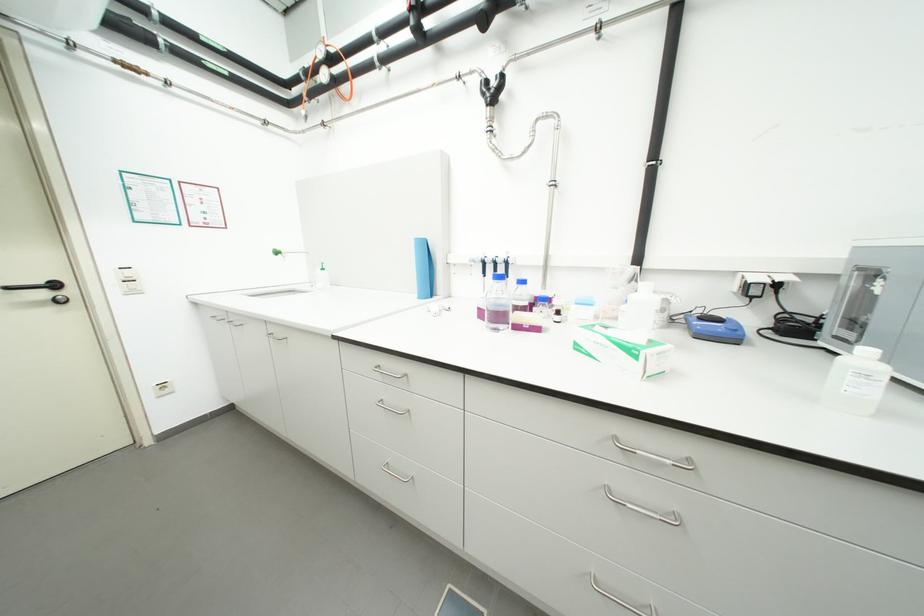
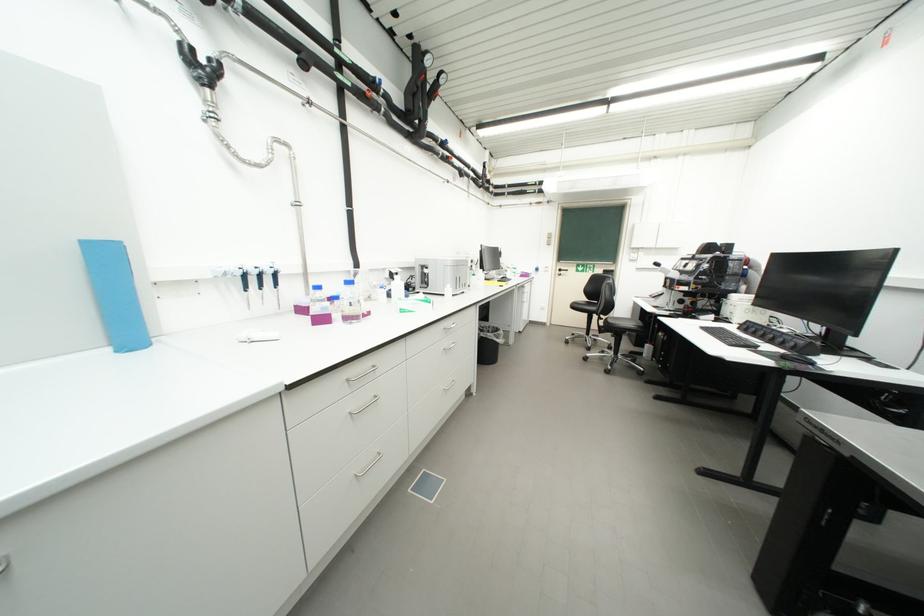
Locate, in the second image, the point that corresponds to the point at 744,288 in the first image.

(395, 277)